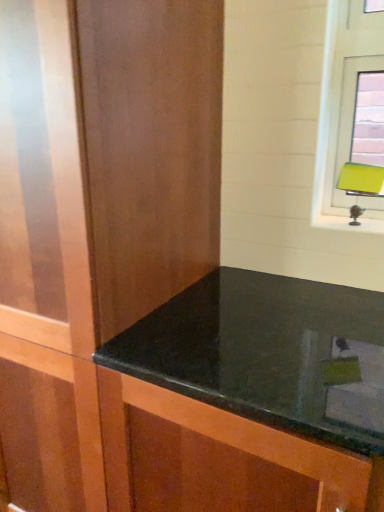
Where is `green matte table lamp at upper right`? Image resolution: width=384 pixels, height=512 pixels. green matte table lamp at upper right is located at coordinates (361, 179).

Where is `black granite countertop at center`? This screenshot has height=512, width=384. black granite countertop at center is located at coordinates (266, 353).

Can you confirm if matte wood dresser at center is positioned to the right of green matte table lamp at upper right?

Incorrect, matte wood dresser at center is not on the right side of green matte table lamp at upper right.

Is matte wood dresser at center wider than green matte table lamp at upper right?

Yes.

Measure the distance from matte wood dresser at center to green matte table lamp at upper right.

matte wood dresser at center and green matte table lamp at upper right are 31.87 inches apart from each other.

Who is taller, matte wood dresser at center or green matte table lamp at upper right?

matte wood dresser at center is taller.

Based on the photo, from a real-world perspective, is green matte table lamp at upper right on matte wood dresser at center?

Correct, in the physical world, green matte table lamp at upper right is higher than matte wood dresser at center.

Consider the image. Visually, is green matte table lamp at upper right positioned to the left or to the right of matte wood dresser at center?

green matte table lamp at upper right is positioned on matte wood dresser at center's right side.

How different are the orientations of green matte table lamp at upper right and matte wood dresser at center in degrees?

The angular difference between green matte table lamp at upper right and matte wood dresser at center is 22.2 degrees.

Which of these two, black granite countertop at center or matte wood dresser at center, is thinner?

Thinner between the two is matte wood dresser at center.

Which object is more forward, black granite countertop at center or matte wood dresser at center?

black granite countertop at center is closer to the camera.

Measure the distance between black granite countertop at center and matte wood dresser at center.

They are 37.42 centimeters apart.

Which is correct: black granite countertop at center is inside matte wood dresser at center, or outside of it?

black granite countertop at center is located beyond the bounds of matte wood dresser at center.

From a real-world perspective, is black granite countertop at center above or below green matte table lamp at upper right?

Clearly, from a real-world perspective, black granite countertop at center is below green matte table lamp at upper right.

Between point (363, 398) and point (344, 186), which one is positioned in front?

The point (363, 398) is more forward.

Considering the relative sizes of black granite countertop at center and green matte table lamp at upper right in the image provided, is black granite countertop at center smaller than green matte table lamp at upper right?

No, black granite countertop at center is not smaller than green matte table lamp at upper right.

Considering the relative positions of black granite countertop at center and green matte table lamp at upper right in the image provided, is black granite countertop at center behind green matte table lamp at upper right?

That is False.

Is green matte table lamp at upper right to the left or to the right of black granite countertop at center in the image?

green matte table lamp at upper right is to the right of black granite countertop at center.

Considering the sizes of objects green matte table lamp at upper right and black granite countertop at center in the image provided, who is wider, green matte table lamp at upper right or black granite countertop at center?

With larger width is black granite countertop at center.

Does green matte table lamp at upper right have a lesser height compared to black granite countertop at center?

Indeed, green matte table lamp at upper right has a lesser height compared to black granite countertop at center.

Is matte wood dresser at center oriented away from black granite countertop at center?

That's not correct — matte wood dresser at center is not looking away from black granite countertop at center.

Is there a large distance between matte wood dresser at center and black granite countertop at center?

No, matte wood dresser at center is not far away from black granite countertop at center.

From a real-world perspective, is matte wood dresser at center above or below black granite countertop at center?

matte wood dresser at center is situated higher than black granite countertop at center in the real world.

What are the coordinates of `dresser in front of the green matte table lamp at upper right` in the screenshot? It's located at (95, 212).

The width and height of the screenshot is (384, 512). What are the coordinates of `table lamp above the matte wood dresser at center (from the image's perspective)` in the screenshot? It's located at (361, 179).

When comparing their distances from matte wood dresser at center, does green matte table lamp at upper right or black granite countertop at center seem further?

green matte table lamp at upper right is further to matte wood dresser at center.

From the image, which object appears to be farther from matte wood dresser at center, black granite countertop at center or green matte table lamp at upper right?

The object further to matte wood dresser at center is green matte table lamp at upper right.

Looking at the image, which one is located closer to black granite countertop at center, green matte table lamp at upper right or matte wood dresser at center?

Among the two, matte wood dresser at center is located nearer to black granite countertop at center.

Estimate the real-world distances between objects in this image. Which object is further from green matte table lamp at upper right, matte wood dresser at center or black granite countertop at center?

matte wood dresser at center is positioned further to the anchor green matte table lamp at upper right.

When comparing their distances from black granite countertop at center, does matte wood dresser at center or green matte table lamp at upper right seem closer?

matte wood dresser at center lies closer to black granite countertop at center than the other object.

Estimate the real-world distances between objects in this image. Which object is closer to green matte table lamp at upper right, black granite countertop at center or matte wood dresser at center?

Based on the image, black granite countertop at center appears to be nearer to green matte table lamp at upper right.

Where is `countertop between matte wood dresser at center and green matte table lamp at upper right`? This screenshot has height=512, width=384. countertop between matte wood dresser at center and green matte table lamp at upper right is located at coordinates (266, 353).